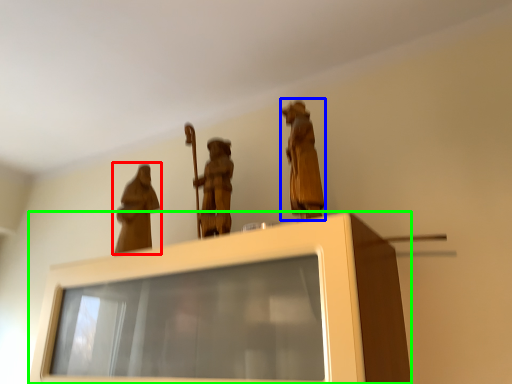
Question: Estimate the real-world distances between objects in this image. Which object is closer to person (highlighted by a red box), person (highlighted by a blue box) or furniture (highlighted by a green box)?

Choices:
 (A) person
 (B) furniture

Answer: (B)